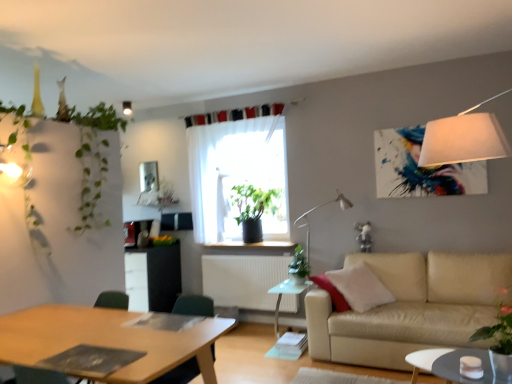
Question: Can you confirm if white glossy coffee table at lower right is positioned to the left of wooden desk at lower left?

Choices:
 (A) no
 (B) yes

Answer: (A)

Question: From the image's perspective, does white glossy coffee table at lower right appear lower than wooden desk at lower left?

Choices:
 (A) no
 (B) yes

Answer: (B)

Question: Are white glossy coffee table at lower right and wooden desk at lower left far apart?

Choices:
 (A) yes
 (B) no

Answer: (A)

Question: Is white glossy coffee table at lower right looking in the opposite direction of wooden desk at lower left?

Choices:
 (A) no
 (B) yes

Answer: (A)

Question: Is white glossy coffee table at lower right wider than wooden desk at lower left?

Choices:
 (A) yes
 (B) no

Answer: (B)

Question: Can you confirm if white glossy coffee table at lower right is thinner than wooden desk at lower left?

Choices:
 (A) yes
 (B) no

Answer: (A)

Question: Considering the relative sizes of white glossy coffee table at lower right and green leafy plant at center, the 5th plant viewed from the front, in the image provided, is white glossy coffee table at lower right shorter than green leafy plant at center, the 5th plant viewed from the front,?

Choices:
 (A) no
 (B) yes

Answer: (B)

Question: Does white glossy coffee table at lower right have a lesser width compared to green leafy plant at center, which is the fourth plant in right-to-left order?

Choices:
 (A) yes
 (B) no

Answer: (B)

Question: From the image's perspective, is white glossy coffee table at lower right on top of green leafy plant at center, which is the fourth plant in right-to-left order?

Choices:
 (A) yes
 (B) no

Answer: (B)

Question: Does white glossy coffee table at lower right have a larger size compared to green leafy plant at center, placed as the 1th plant when sorted from back to front?

Choices:
 (A) yes
 (B) no

Answer: (A)

Question: Does white glossy coffee table at lower right come behind green leafy plant at center, which is the fourth plant in right-to-left order?

Choices:
 (A) yes
 (B) no

Answer: (B)

Question: Considering the relative sizes of white glossy coffee table at lower right and green leafy plant at center, the 5th plant viewed from the front, in the image provided, is white glossy coffee table at lower right smaller than green leafy plant at center, the 5th plant viewed from the front,?

Choices:
 (A) yes
 (B) no

Answer: (B)

Question: Would you say beige leather couch at lower right contains green matte plant at center, which appears as the 2th plant when viewed from the back?

Choices:
 (A) yes
 (B) no

Answer: (B)